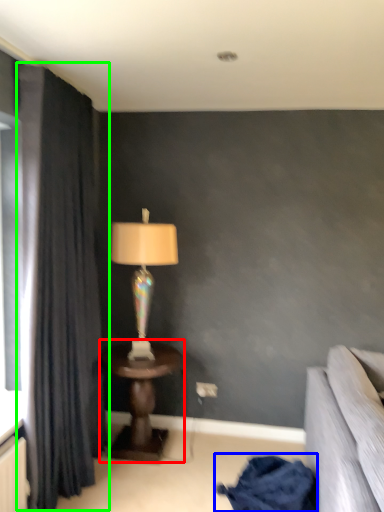
Question: Which is farther away from table (highlighted by a red box)? blanket (highlighted by a blue box) or curtain (highlighted by a green box)?

Choices:
 (A) blanket
 (B) curtain

Answer: (A)